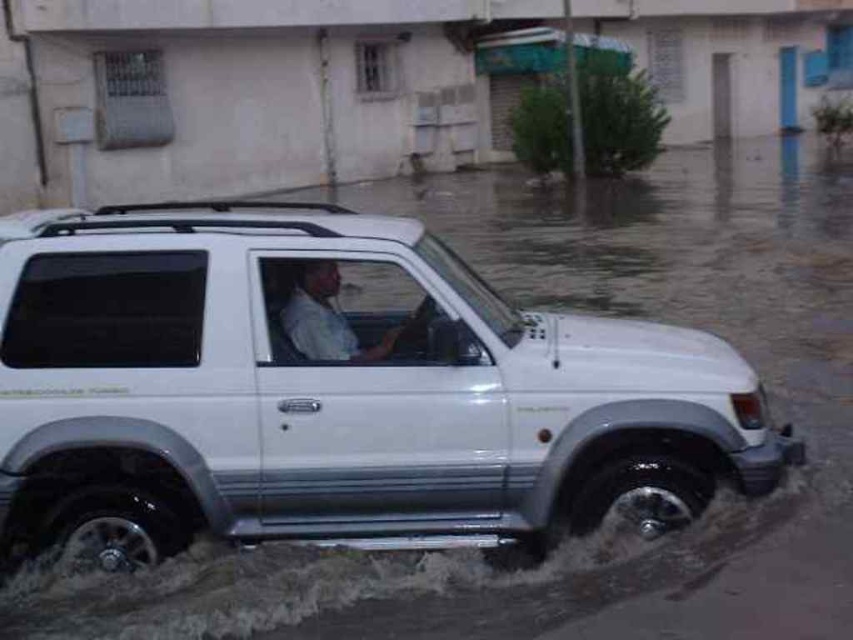
You are a delivery robot that needs to pass under a low bridge. The bridge has a clearance of 1.8 meters. You observe the white matte suv at center and the white matte shirt at center in the scene. Which object would require you to adjust your path to avoid collision?

The white matte suv at center has a greater height compared to the white matte shirt at center. Therefore, the delivery robot must adjust its path to avoid collision with the white matte suv at center since it is taller than the 1.8 meters clearance.

You are a drone operator trying to capture the SUV from above. You have two points marked on your screen for camera positioning. The first point is at coordinates point [142,636] and the second is at point [297,284]. Which point should you choose to position your camera so that it is closer to the front of the SUV?

Point [142,636] is in front of point [297,284], so choosing point [142,636] will position the camera closer to the front of the SUV.